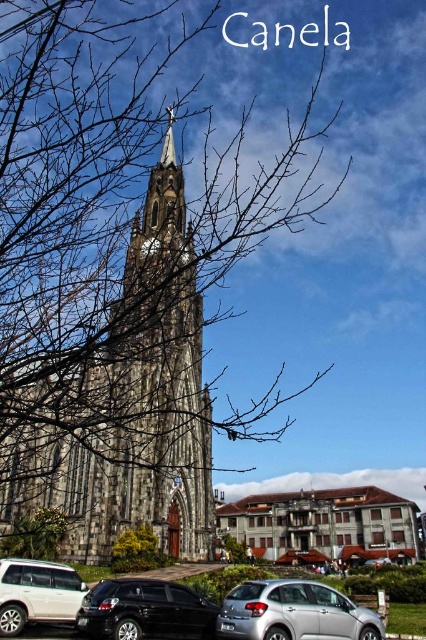
Does silver metallic car at lower center have a lesser width compared to white matte suv at lower left?

In fact, silver metallic car at lower center might be wider than white matte suv at lower left.

Who is positioned more to the left, silver metallic car at lower center or white matte suv at lower left?

white matte suv at lower left is more to the left.

I want to click on silver metallic car at lower center, so click(293, 612).

This screenshot has width=426, height=640. I want to click on silver metallic car at lower center, so click(293, 612).

Between bare branches at center and brown stone church at center, which one appears on the right side from the viewer's perspective?

Positioned to the right is brown stone church at center.

What do you see at coordinates (117, 280) in the screenshot? Image resolution: width=426 pixels, height=640 pixels. I see `bare branches at center` at bounding box center [117, 280].

At what (x,y) coordinates should I click in order to perform the action: click on bare branches at center. Please return your answer as a coordinate pair (x, y). Image resolution: width=426 pixels, height=640 pixels. Looking at the image, I should click on (117, 280).

Who is more distant from viewer, (244, 497) or (423, 618)?

The point (244, 497) is more distant.

Is brown stone church at center wider than green grass at lower center?

In fact, brown stone church at center might be narrower than green grass at lower center.

This screenshot has width=426, height=640. Identify the location of brown stone church at center. (324, 524).

Locate an element on the screen. The height and width of the screenshot is (640, 426). brown stone church at center is located at coordinates (324, 524).